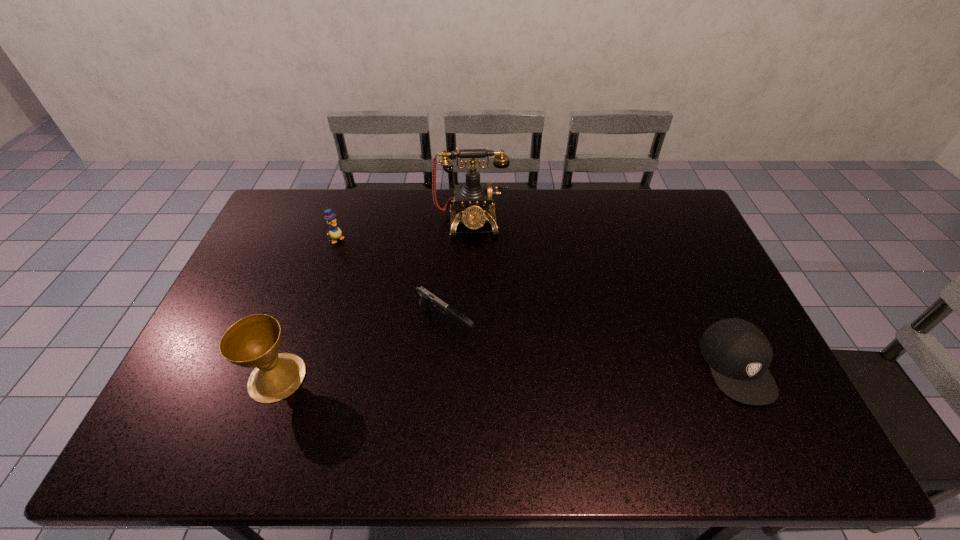
Where is `vacant space at the far edge of the desktop`? This screenshot has height=540, width=960. vacant space at the far edge of the desktop is located at coordinates (438, 191).

Find the location of a particular element. The height and width of the screenshot is (540, 960). vacant space at the near edge of the desktop is located at coordinates (352, 391).

Identify the location of free space at the left edge of the desktop. (284, 252).

Locate an element on the screen. vacant space at the right edge of the desktop is located at coordinates (671, 234).

Find the location of `free space at the far left corner of the desktop`. free space at the far left corner of the desktop is located at coordinates (316, 210).

I want to click on vacant space at the far right corner of the desktop, so click(678, 207).

In order to click on vacant area that lies between the fourth shortest object and the cap in this screenshot , I will do `click(507, 372)`.

Where is `vacant area that lies between the rightmost object and the duckling`? vacant area that lies between the rightmost object and the duckling is located at coordinates (537, 302).

The image size is (960, 540). In order to click on unoccupied area between the chalice and the tallest object in this screenshot , I will do `click(374, 300)`.

Where is `unoccupied position between the cap and the duckling`? The width and height of the screenshot is (960, 540). unoccupied position between the cap and the duckling is located at coordinates (537, 302).